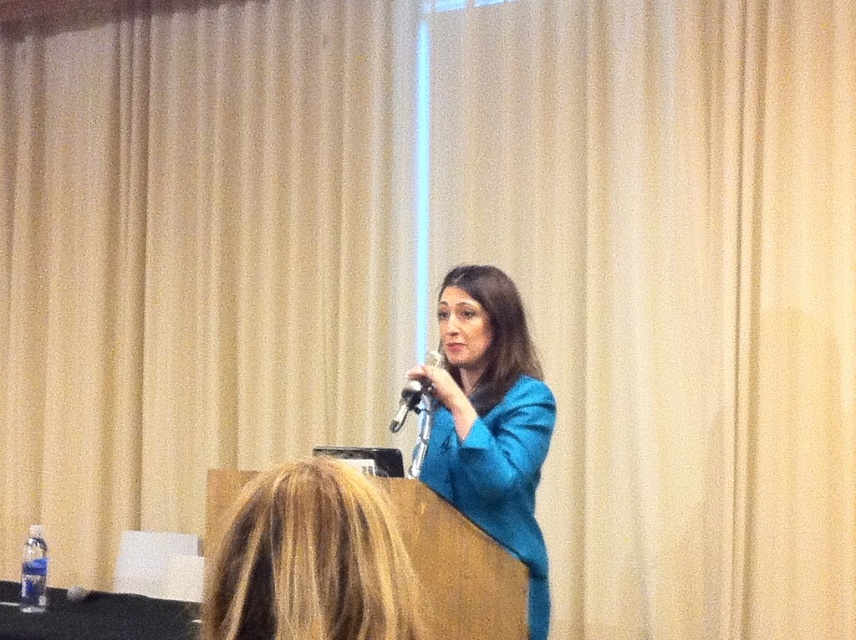
Who is positioned more to the right, beige textured curtain at upper center or blonde hair at upper center?

From the viewer's perspective, blonde hair at upper center appears more on the right side.

Can you confirm if beige textured curtain at upper center is positioned below blonde hair at upper center?

No, beige textured curtain at upper center is not below blonde hair at upper center.

Which is behind, point (12, 248) or point (397, 580)?

The point (12, 248) is more distant.

Where is `beige textured curtain at upper center`? The width and height of the screenshot is (856, 640). beige textured curtain at upper center is located at coordinates coord(186,260).

Does blue fabric at center come in front of metallic silver microphone at center?

That is True.

Which of these two, blue fabric at center or metallic silver microphone at center, stands taller?

Standing taller between the two is blue fabric at center.

The width and height of the screenshot is (856, 640). Identify the location of blue fabric at center. point(490,420).

Where is `blue fabric at center`? The image size is (856, 640). blue fabric at center is located at coordinates (490, 420).

Does beige textured curtain at upper center have a lesser height compared to metallic silver microphone at center?

In fact, beige textured curtain at upper center may be taller than metallic silver microphone at center.

Which is more to the right, beige textured curtain at upper center or metallic silver microphone at center?

metallic silver microphone at center

Locate an element on the screen. Image resolution: width=856 pixels, height=640 pixels. beige textured curtain at upper center is located at coordinates (186, 260).